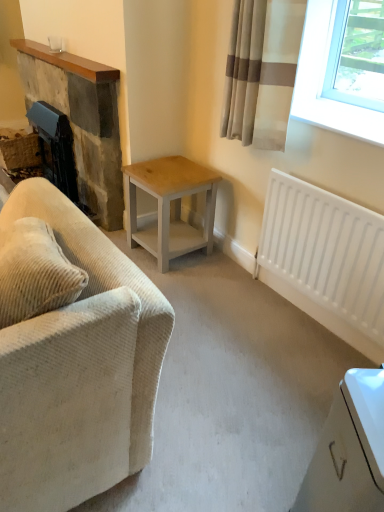
At what (x,y) coordinates should I click in order to perform the action: click on vacant area on top of light wood/grey painted table at center (from a real-world perspective). Please return your answer as a coordinate pair (x, y). Looking at the image, I should click on (165, 172).